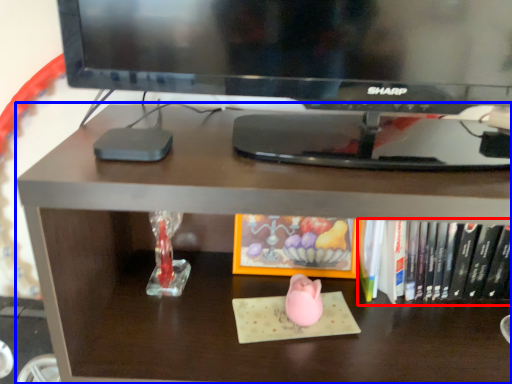
Question: Which point is further to the camera, book (highlighted by a red box) or desk (highlighted by a blue box)?

Choices:
 (A) book
 (B) desk

Answer: (A)